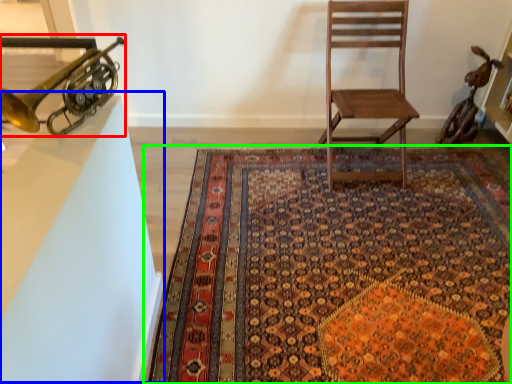
Question: Which object is the farthest from trumpet (highlighted by a red box)? Choose among these: table (highlighted by a blue box) or mat (highlighted by a green box).

Choices:
 (A) table
 (B) mat

Answer: (B)